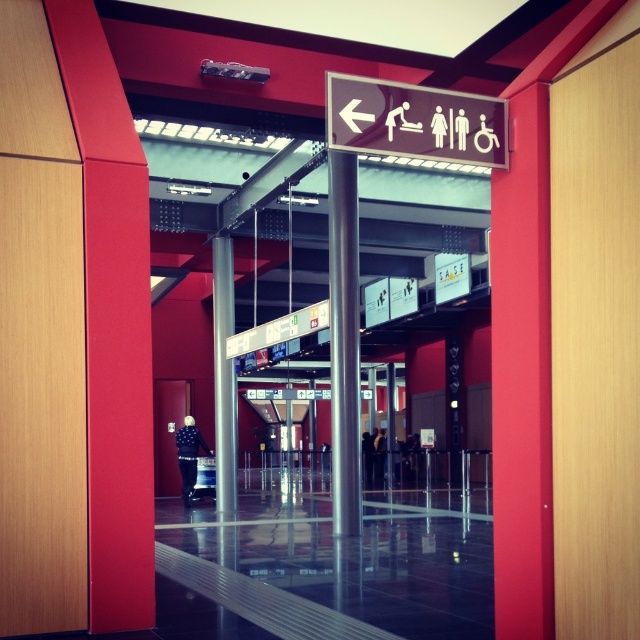
Is brown plastic sign at upper center thinner than metallic pole at center?

No, brown plastic sign at upper center is not thinner than metallic pole at center.

Image resolution: width=640 pixels, height=640 pixels. I want to click on brown plastic sign at upper center, so click(413, 122).

Between point (333, 458) and point (230, 465), which one is positioned in front?

Point (333, 458)

Who is positioned more to the left, metallic pole at center or metallic silver pole at center?

Positioned to the left is metallic silver pole at center.

You are a GUI agent. You are given a task and a screenshot of the screen. Output one action in this format:
    pyautogui.click(x=<x>, y=<y>)
    Task: Click on the metallic pole at center
    The image size is (640, 640).
    Given the screenshot: What is the action you would take?
    pyautogui.click(x=342, y=340)

Find the location of a particular element. This screenshot has width=640, height=640. metallic pole at center is located at coordinates 342,340.

Can you confirm if brown plastic sign at upper center is bigger than metallic silver pole at center?

No.

Find the location of a particular element. This screenshot has width=640, height=640. brown plastic sign at upper center is located at coordinates point(413,122).